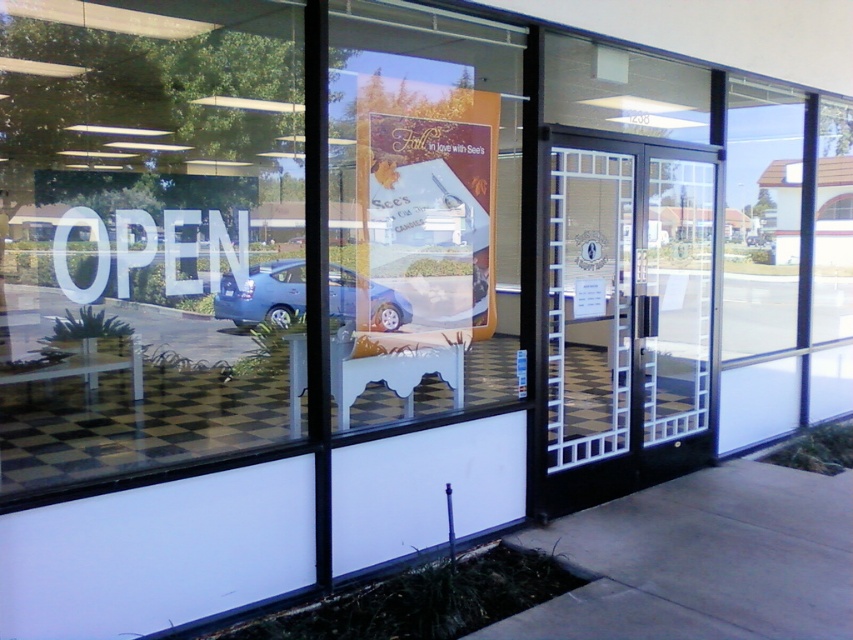
Which is in front, point (186, 120) or point (296, 264)?

Point (296, 264) is more forward.

Does white plastic sign at left have a larger size compared to matte blue car at center?

No, white plastic sign at left is not bigger than matte blue car at center.

Does point (97, 88) lie behind point (347, 321)?

Yes, it is.

Locate an element on the screen. This screenshot has height=640, width=853. white plastic sign at left is located at coordinates (140, 228).

Between matte orange poster at center and matte blue car at center, which one has less height?

With less height is matte blue car at center.

This screenshot has height=640, width=853. What are the coordinates of `matte orange poster at center` in the screenshot? It's located at (422, 209).

The height and width of the screenshot is (640, 853). I want to click on matte orange poster at center, so click(422, 209).

Does matte orange poster at center come in front of black glass door at center?

Yes, matte orange poster at center is closer to the viewer.

Is point (512, 132) closer to viewer compared to point (630, 467)?

No.

The image size is (853, 640). I want to click on matte orange poster at center, so click(x=422, y=209).